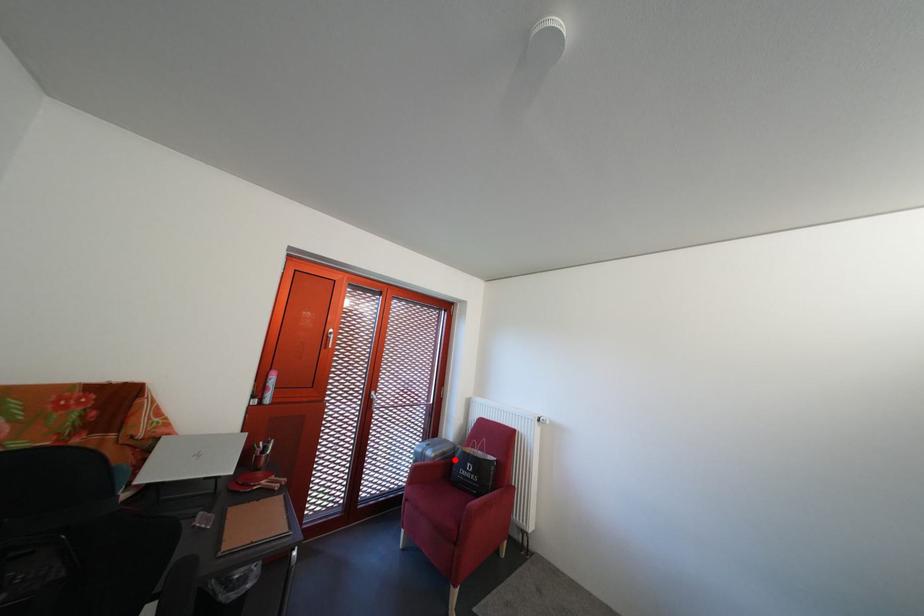
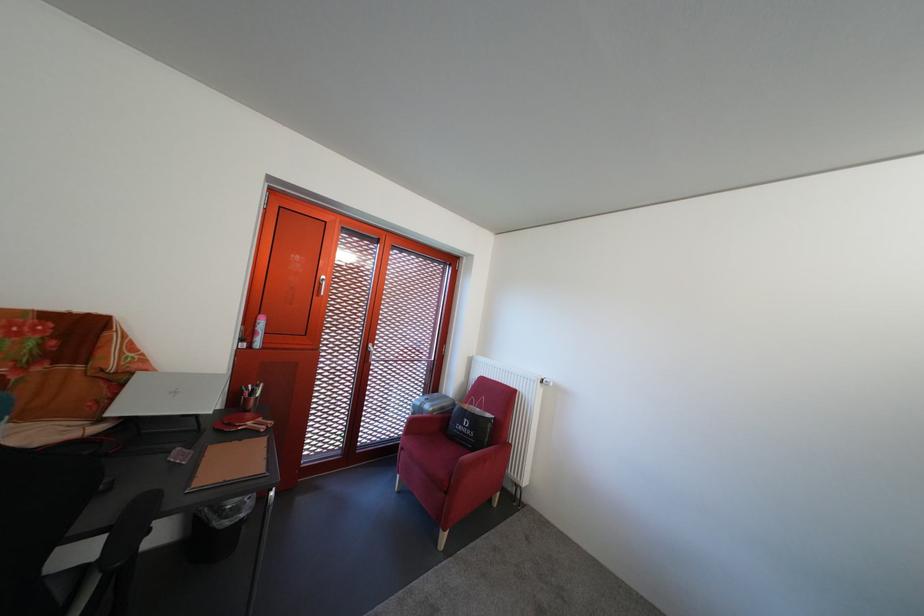
Find the pixel in the second image that matches the highlighted location in the first image.

(454, 415)